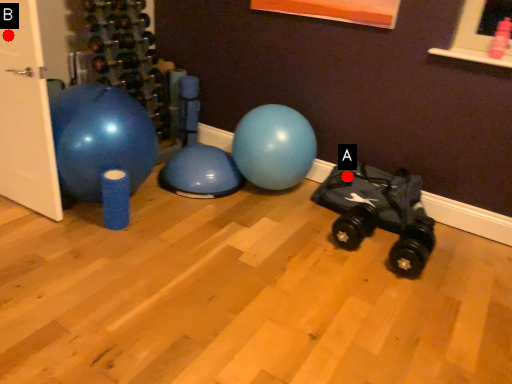
Question: Two points are circled on the image, labeled by A and B beside each circle. Which point is further to the camera?

Choices:
 (A) A is further
 (B) B is further

Answer: (A)